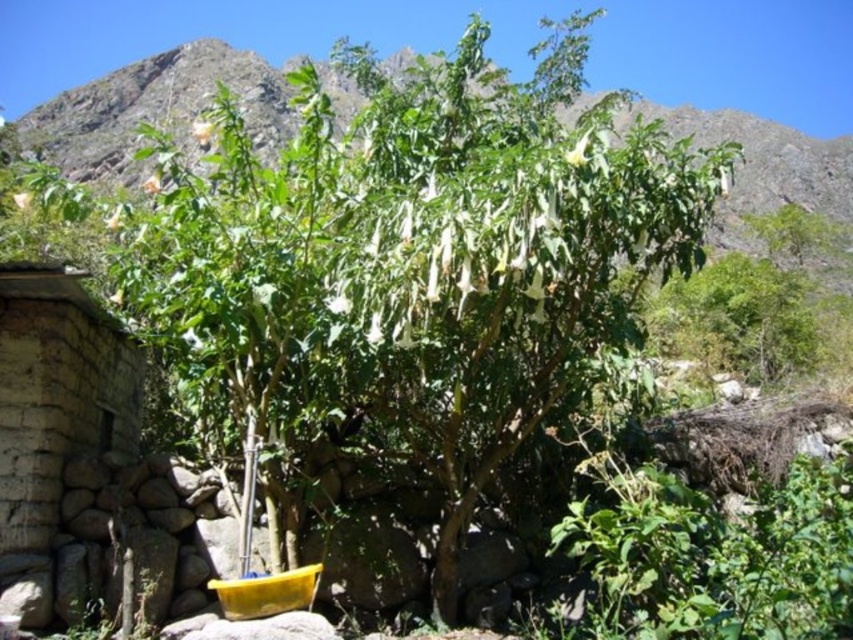
You are standing at a viewpoint overlooking a natural area with a Datura tree and a stone structure. You want to know if you can walk directly from your current position to the point marked at coordinates point (263,147) without any obstacles. Based on the scene description, is there a clear path? Explain your reasoning.

The point marked at coordinates point (263,147) is 111.86 meters away from the viewer. Since the scene describes a lush green tree with dense foliage and a rustic stone structure in the foreground, there may be obstacles like branches or the stone structure itself blocking the direct path. However, the description does not explicitly mention any obstacles between the viewer and the point. Therefore, it is possible there is a clear path, but potential obstructions like the tree branches or the stone near

You are standing in front of the stone wall at left and want to water the green leafy plant at center. Can you reach the plant with a standard garden hose that is 2 meters long?

The green leafy plant at center is located above the stone wall at left, so you can reach it with a standard garden hose that is 2 meters long as the distance between them is within the hose length.

You are standing in front of the green leafy plant at center and the stone wall at left. Which object is wider?

The green leafy plant at center is wider than the stone wall at left.